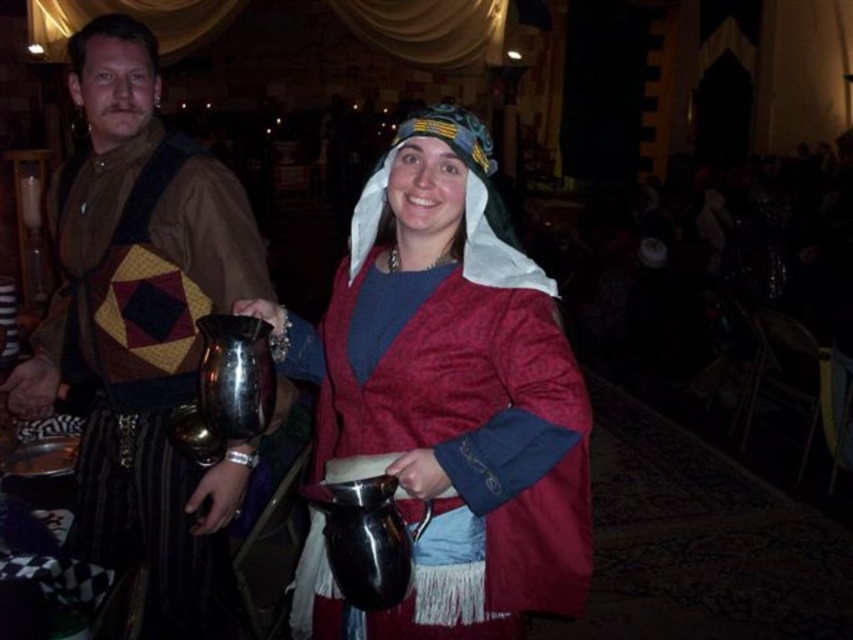
Question: Is metallic jug at center below metallic pitcher at center?

Choices:
 (A) no
 (B) yes

Answer: (A)

Question: Which of the following is the farthest from the observer?

Choices:
 (A) metallic jug at center
 (B) metallic pitcher at center

Answer: (B)

Question: Does metallic pitcher at center lie behind brushed metal jug at left?

Choices:
 (A) no
 (B) yes

Answer: (A)

Question: Estimate the real-world distances between objects in this image. Which object is closer to the metallic jug at center?

Choices:
 (A) brushed metal jug at left
 (B) metallic pitcher at center

Answer: (B)

Question: Which of the following is the farthest from the observer?

Choices:
 (A) metallic pitcher at center
 (B) brushed metal jug at left

Answer: (B)

Question: Can you confirm if metallic jug at center is positioned below brushed metal jug at left?

Choices:
 (A) yes
 (B) no

Answer: (B)